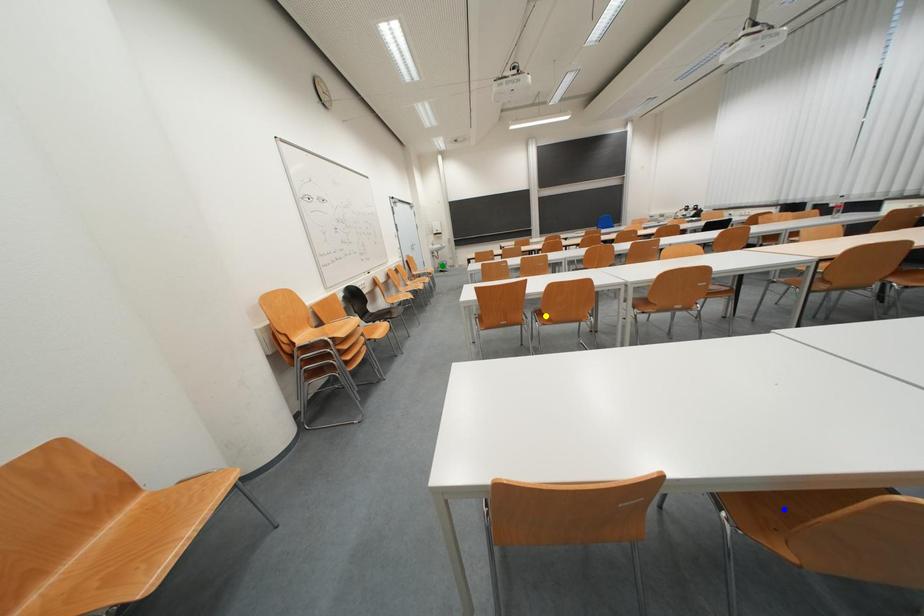
Order these from farthest to nearest:
1. green point
2. yellow point
3. blue point

green point, yellow point, blue point